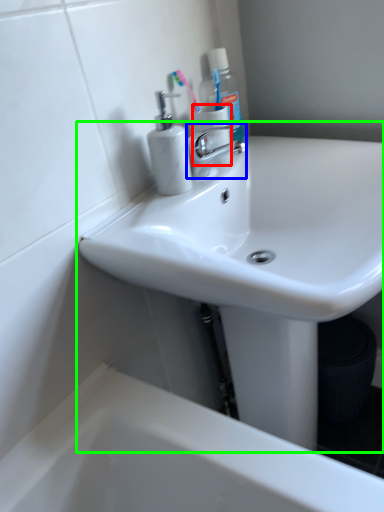
Question: Which object is positioned closest to toilet paper (highlighted by a red box)? Select from tap (highlighted by a blue box) and sink (highlighted by a green box).

Choices:
 (A) tap
 (B) sink

Answer: (A)